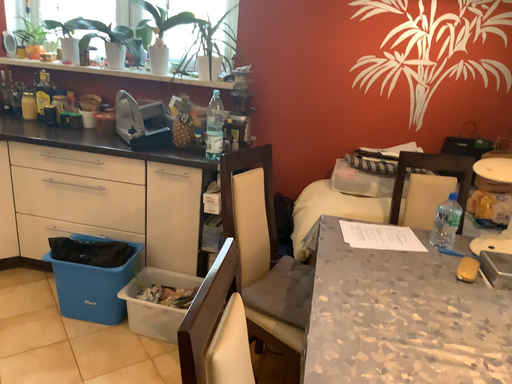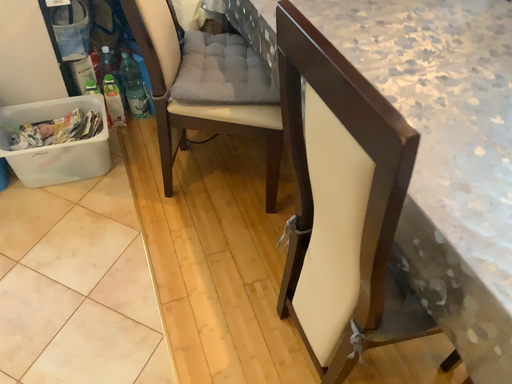
Question: How did the camera likely rotate when shooting the video?

Choices:
 (A) rotated downward
 (B) rotated upward

Answer: (A)